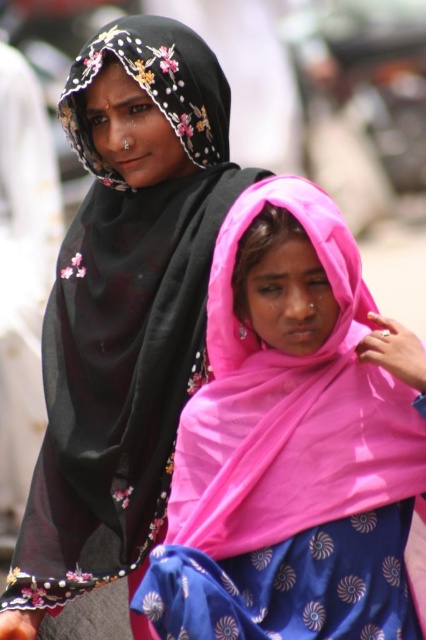
Question: Which object appears farthest from the camera in this image?

Choices:
 (A) pink satin scarf at center
 (B) black sheer headscarf at upper left

Answer: (B)

Question: Is pink satin scarf at center wider than black sheer headscarf at upper left?

Choices:
 (A) no
 (B) yes

Answer: (A)

Question: Which point appears farthest from the camera in this image?

Choices:
 (A) (120, 124)
 (B) (152, 552)

Answer: (A)

Question: Is black sheer scarf at upper left wider than black sheer headscarf at upper left?

Choices:
 (A) yes
 (B) no

Answer: (A)

Question: Among these objects, which one is nearest to the camera?

Choices:
 (A) black sheer headscarf at upper left
 (B) black sheer scarf at upper left

Answer: (B)

Question: Can you confirm if pink satin scarf at center is bigger than black sheer scarf at upper left?

Choices:
 (A) yes
 (B) no

Answer: (B)